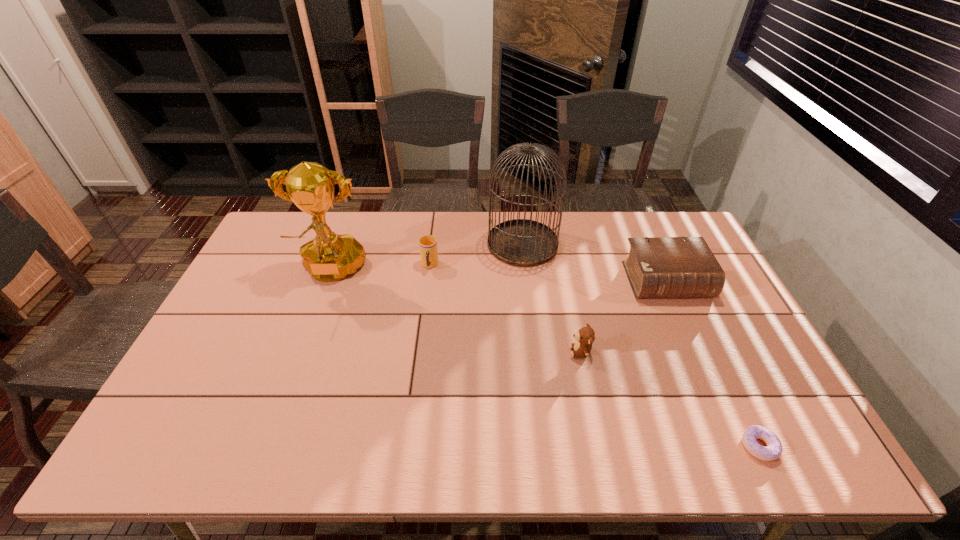
Locate an element on the screen. The height and width of the screenshot is (540, 960). blank space located on the side of the cup with the handle is located at coordinates (426, 295).

This screenshot has width=960, height=540. I want to click on vacant region located on the face of the second nearest object, so click(x=544, y=352).

This screenshot has width=960, height=540. I want to click on vacant region located on the face of the second nearest object, so click(x=476, y=352).

This screenshot has width=960, height=540. I want to click on free space located on the face of the second nearest object, so click(501, 352).

Image resolution: width=960 pixels, height=540 pixels. Identify the location of vacant area located 0.360m on the back of the doughnut. (697, 318).

Find the location of a particular element. This screenshot has height=540, width=960. birdcage situated at the far edge is located at coordinates (519, 242).

Identify the location of award at the far edge. 329,257.

At what (x,y) coordinates should I click in order to perform the action: click on object that is at the near edge. Please return your answer as a coordinate pair (x, y). Image resolution: width=960 pixels, height=540 pixels. Looking at the image, I should click on (773, 450).

Locate an element on the screen. The image size is (960, 540). object positioned at the left edge is located at coordinates (329, 257).

You are a GUI agent. You are given a task and a screenshot of the screen. Output one action in this format:
    pyautogui.click(x=<x>, y=<y>)
    Task: Click on the Bible that is at the right edge
    This screenshot has width=960, height=540.
    Given the screenshot: What is the action you would take?
    pyautogui.click(x=657, y=267)